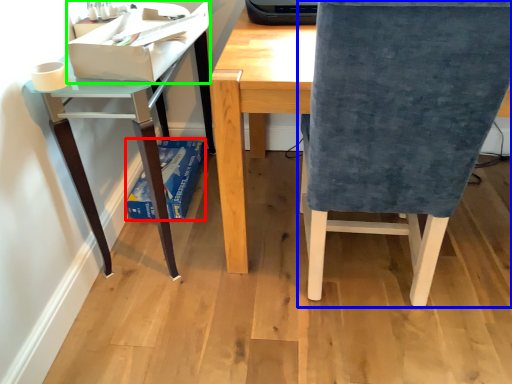
Question: Estimate the real-world distances between objects in this image. Which object is farther from paperback book (highlighted by a red box), chair (highlighted by a blue box) or paperback book (highlighted by a green box)?

Choices:
 (A) chair
 (B) paperback book

Answer: (A)